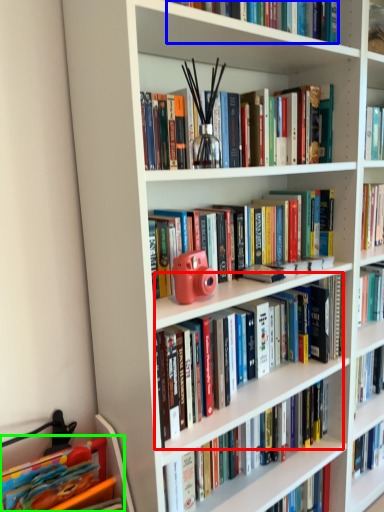
Question: Which object is positioned farthest from book (highlighted by a red box)? Select from book (highlighted by a blue box) and book (highlighted by a green box).

Choices:
 (A) book
 (B) book

Answer: (A)